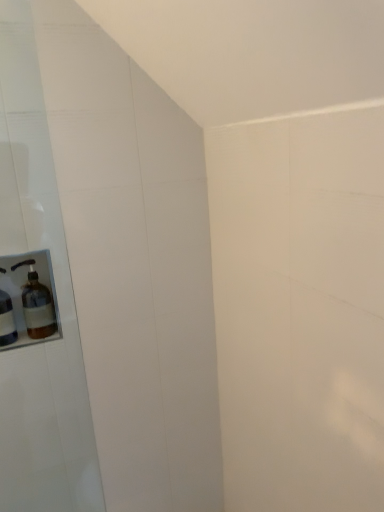
Question: Should I look upward or downward to see brown glass bottle at left, which appears as the 1th bottle when viewed from the right?

Choices:
 (A) up
 (B) down

Answer: (B)

Question: Could you tell me if brown glass bottle at left, the 2th bottle positioned from the left, is turned towards translucent glass soap dispenser at left, arranged as the 2th bottle when viewed from the right?

Choices:
 (A) no
 (B) yes

Answer: (A)

Question: Can you confirm if brown glass bottle at left, the 2th bottle positioned from the left, is wider than translucent glass soap dispenser at left, arranged as the 2th bottle when viewed from the right?

Choices:
 (A) yes
 (B) no

Answer: (A)

Question: Is brown glass bottle at left, which appears as the 1th bottle when viewed from the right, positioned with its back to translucent glass soap dispenser at left, arranged as the 2th bottle when viewed from the right?

Choices:
 (A) no
 (B) yes

Answer: (A)

Question: From the image's perspective, does brown glass bottle at left, which appears as the 1th bottle when viewed from the right, appear lower than translucent glass soap dispenser at left, the first bottle from the left?

Choices:
 (A) yes
 (B) no

Answer: (B)

Question: From a real-world perspective, is brown glass bottle at left, the 2th bottle positioned from the left, on translucent glass soap dispenser at left, arranged as the 2th bottle when viewed from the right?

Choices:
 (A) no
 (B) yes

Answer: (B)

Question: Is brown glass bottle at left, the 2th bottle positioned from the left, at the left side of translucent glass soap dispenser at left, arranged as the 2th bottle when viewed from the right?

Choices:
 (A) yes
 (B) no

Answer: (B)

Question: Is translucent glass soap dispenser at left, the first bottle from the left, surrounding brown glass bottle at left, the 2th bottle positioned from the left?

Choices:
 (A) yes
 (B) no

Answer: (B)

Question: From the image's perspective, would you say translucent glass soap dispenser at left, arranged as the 2th bottle when viewed from the right, is shown under brown glass bottle at left, the 2th bottle positioned from the left?

Choices:
 (A) yes
 (B) no

Answer: (A)

Question: From a real-world perspective, is translucent glass soap dispenser at left, arranged as the 2th bottle when viewed from the right, on top of brown glass bottle at left, the 2th bottle positioned from the left?

Choices:
 (A) yes
 (B) no

Answer: (B)

Question: Is translucent glass soap dispenser at left, the first bottle from the left, wider than brown glass bottle at left, the 2th bottle positioned from the left?

Choices:
 (A) no
 (B) yes

Answer: (A)

Question: Is translucent glass soap dispenser at left, arranged as the 2th bottle when viewed from the right, taller than brown glass bottle at left, which appears as the 1th bottle when viewed from the right?

Choices:
 (A) yes
 (B) no

Answer: (A)

Question: Are translucent glass soap dispenser at left, arranged as the 2th bottle when viewed from the right, and brown glass bottle at left, the 2th bottle positioned from the left, making contact?

Choices:
 (A) no
 (B) yes

Answer: (B)

Question: Is point (4, 326) closer or farther from the camera than point (34, 311)?

Choices:
 (A) farther
 (B) closer

Answer: (B)